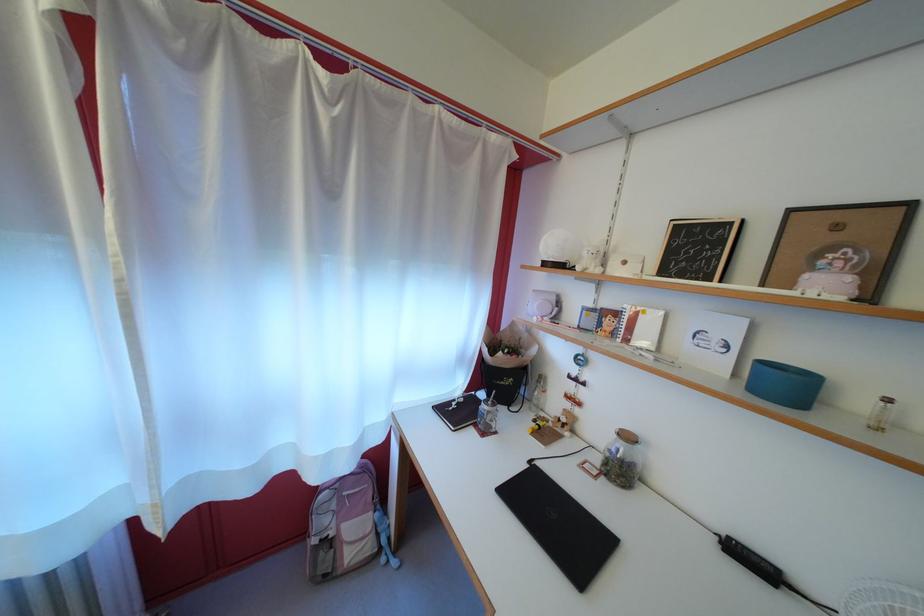
Find where to pull the white curtain. Please return your answer as a coordinate pair (x, y).

(281, 237)